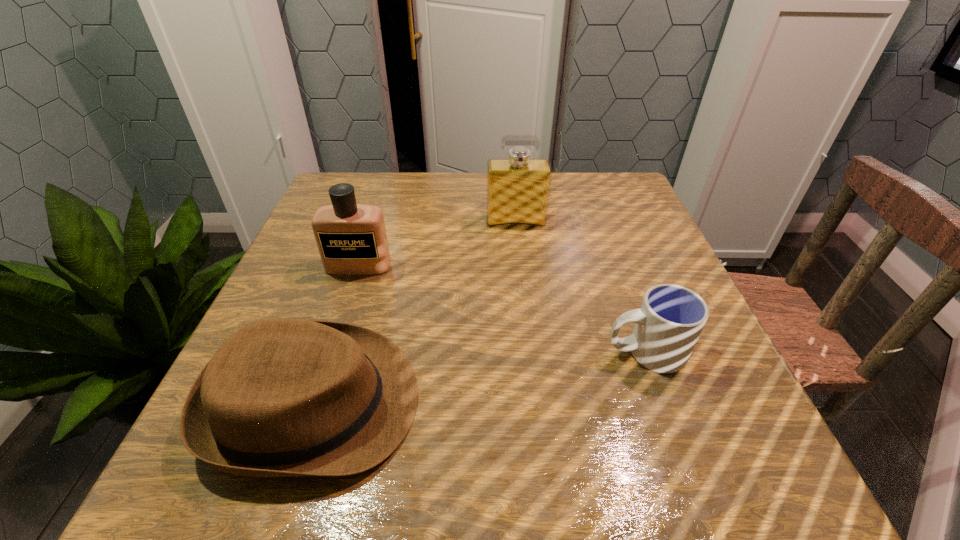
Identify the location of vacant region between the farther perfume and the second farthest object. Image resolution: width=960 pixels, height=540 pixels. (437, 244).

You are a GUI agent. You are given a task and a screenshot of the screen. Output one action in this format:
    pyautogui.click(x=<x>, y=<y>)
    Task: Click on the vacant point located between the fedora and the right perfume
    The width and height of the screenshot is (960, 540).
    Given the screenshot: What is the action you would take?
    pyautogui.click(x=415, y=312)

Find the location of a particular element. vacant space in between the farther perfume and the fedora is located at coordinates (415, 312).

You are a GUI agent. You are given a task and a screenshot of the screen. Output one action in this format:
    pyautogui.click(x=<x>, y=<y>)
    Task: Click on the second closest object to the rightmost object
    The image size is (960, 540).
    Given the screenshot: What is the action you would take?
    pyautogui.click(x=518, y=187)

Image resolution: width=960 pixels, height=540 pixels. In order to click on object that ranks as the second closest to the rightmost object in this screenshot , I will do `click(518, 187)`.

Identify the location of vacant area that satisfies the following two spatial constraints: 1. on the front-facing side of the second object from right to left; 2. on the front-facing side of the fedora. The height and width of the screenshot is (540, 960). (536, 403).

What are the coordinates of `free location that satisfies the following two spatial constraints: 1. on the front-facing side of the farther perfume; 2. on the front-facing side of the fedora` in the screenshot? It's located at (536, 403).